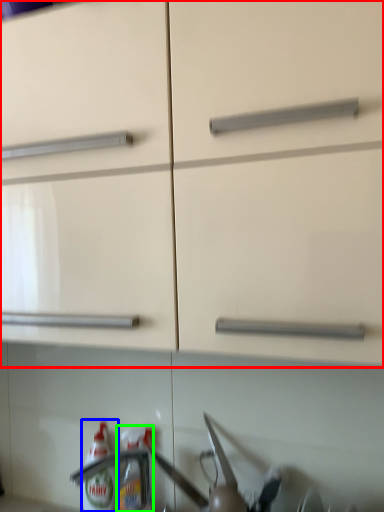
Question: Which object is the closest to the cabinetry (highlighted by a red box)? Choose among these: bottle (highlighted by a blue box) or bottle (highlighted by a green box).

Choices:
 (A) bottle
 (B) bottle

Answer: (B)